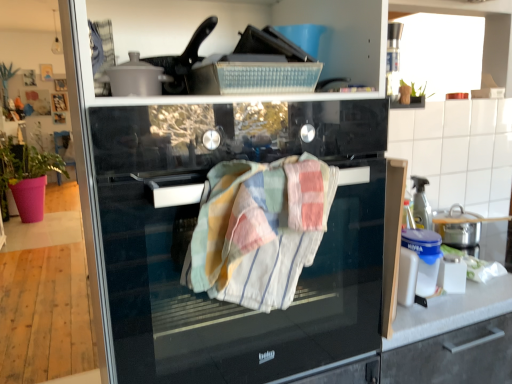
This screenshot has width=512, height=384. What do you see at coordinates (28, 176) in the screenshot?
I see `pink fabric plant at left` at bounding box center [28, 176].

What do you see at coordinates (195, 225) in the screenshot? The image size is (512, 384). I see `black glass oven at center` at bounding box center [195, 225].

Where is `pink fabric plant at left`? The height and width of the screenshot is (384, 512). pink fabric plant at left is located at coordinates (28, 176).

The width and height of the screenshot is (512, 384). Find the location of `plant behind the multicolored woven towel at center`. plant behind the multicolored woven towel at center is located at coordinates (28, 176).

Is multicolored woven towel at center wider than pink fabric plant at left?

In fact, multicolored woven towel at center might be narrower than pink fabric plant at left.

Does point (275, 182) come behind point (8, 150)?

No.

From the image's perspective, which one is positioned higher, multicolored woven towel at center or pink fabric plant at left?

pink fabric plant at left, from the image's perspective.

From a real-world perspective, is black glass oven at center on top of pink fabric plant at left?

Yes, from a real-world perspective, black glass oven at center is on top of pink fabric plant at left.

Considering the sizes of black glass oven at center and pink fabric plant at left in the image, is black glass oven at center wider or thinner than pink fabric plant at left?

Considering their sizes, black glass oven at center looks slimmer than pink fabric plant at left.

Who is taller, black glass oven at center or pink fabric plant at left?

Standing taller between the two is pink fabric plant at left.

Identify the location of home appliance located in front of the pink fabric plant at left. This screenshot has height=384, width=512. tap(195, 225).

From the image's perspective, relative to multicolored woven towel at center, is black glass oven at center above or below?

black glass oven at center is above multicolored woven towel at center.

Is black glass oven at center in front of multicolored woven towel at center?

No, black glass oven at center is further to the viewer.

Consider the image. From a real-world perspective, does black glass oven at center sit lower than multicolored woven towel at center?

Yes.

Does point (151, 187) appear closer or farther from the camera than point (307, 168)?

Point (151, 187).

Do you think multicolored woven towel at center is within black glass oven at center, or outside of it?

The correct answer is: inside.

From the image's perspective, is multicolored woven towel at center located above black glass oven at center?

Incorrect, from the image's perspective, multicolored woven towel at center is lower than black glass oven at center.

The width and height of the screenshot is (512, 384). I want to click on home appliance on the left side of multicolored woven towel at center, so click(x=195, y=225).

Considering the positions of objects multicolored woven towel at center and black glass oven at center in the image provided, who is more to the right, multicolored woven towel at center or black glass oven at center?

multicolored woven towel at center.

Are pink fabric plant at left and black glass oven at center beside each other?

pink fabric plant at left and black glass oven at center are clearly separated.

Considering the positions of objects pink fabric plant at left and black glass oven at center in the image provided, who is behind, pink fabric plant at left or black glass oven at center?

pink fabric plant at left is behind.

From a real-world perspective, is pink fabric plant at left physically located above or below black glass oven at center?

From a real-world perspective, pink fabric plant at left is physically below black glass oven at center.

Does point (24, 174) come farther from viewer compared to point (134, 141)?

Yes, it is behind point (134, 141).

Between pink fabric plant at left and multicolored woven towel at center, which one appears on the left side from the viewer's perspective?

pink fabric plant at left is more to the left.

Where is `bath towel on the right of pink fabric plant at left`? The image size is (512, 384). bath towel on the right of pink fabric plant at left is located at coordinates (259, 230).

From the picture: Is pink fabric plant at left positioned with its back to multicolored woven towel at center?

That's not correct — pink fabric plant at left is not looking away from multicolored woven towel at center.

At what (x,y) coordinates should I click in order to perform the action: click on bath towel in front of the pink fabric plant at left. Please return your answer as a coordinate pair (x, y). This screenshot has width=512, height=384. Looking at the image, I should click on (259, 230).

I want to click on plant below the black glass oven at center (from a real-world perspective), so click(28, 176).

From the image, which object appears to be nearer to pink fabric plant at left, multicolored woven towel at center or black glass oven at center?

Based on the image, black glass oven at center appears to be nearer to pink fabric plant at left.

From the picture: Which object lies further to the anchor point multicolored woven towel at center, black glass oven at center or pink fabric plant at left?

Among the two, pink fabric plant at left is located further to multicolored woven towel at center.

When comparing their distances from multicolored woven towel at center, does pink fabric plant at left or black glass oven at center seem further?

pink fabric plant at left.

Based on their spatial positions, is multicolored woven towel at center or pink fabric plant at left closer to black glass oven at center?

Based on the image, multicolored woven towel at center appears to be nearer to black glass oven at center.

Looking at the image, which one is located further to pink fabric plant at left, black glass oven at center or multicolored woven towel at center?

multicolored woven towel at center is positioned further to the anchor pink fabric plant at left.

Estimate the real-world distances between objects in this image. Which object is closer to black glass oven at center, pink fabric plant at left or multicolored woven towel at center?

multicolored woven towel at center is positioned closer to the anchor black glass oven at center.

Identify the location of home appliance between multicolored woven towel at center and pink fabric plant at left in the front-back direction. (195, 225).